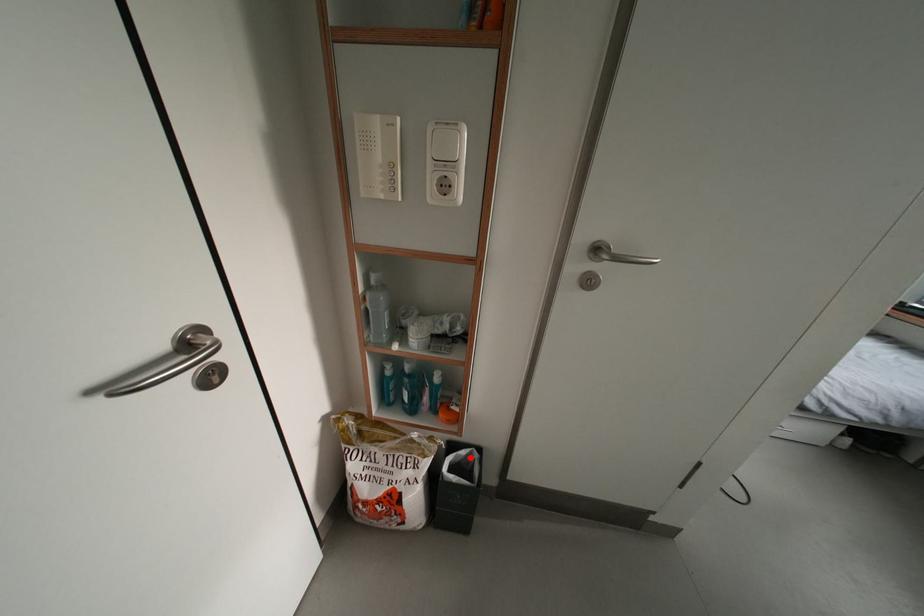
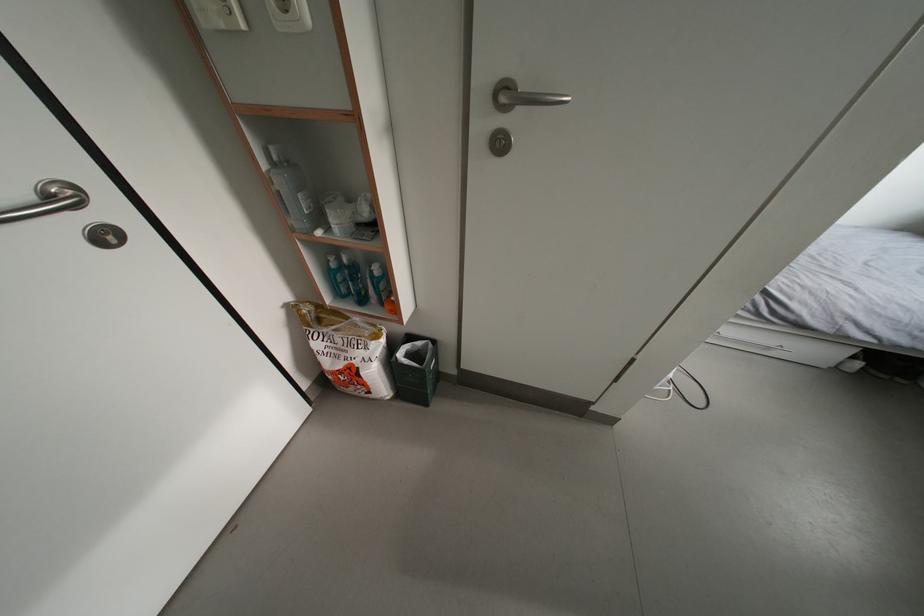
Question: I am providing you with two images of the same scene from different viewpoints. A red point is marked on the first image. Is the red point's position out of view in image 2?

Choices:
 (A) Yes
 (B) No

Answer: (B)